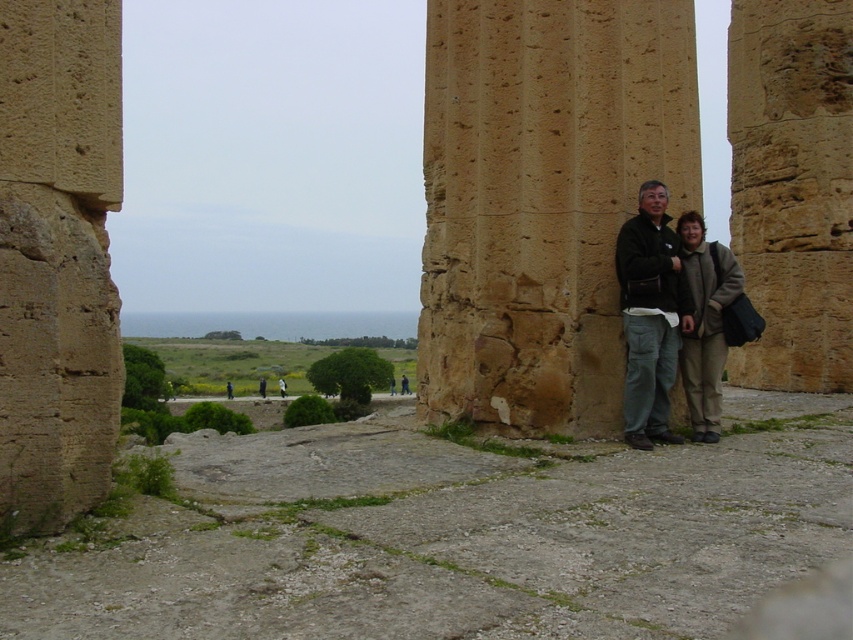
Question: Is brown rough stone pillar at right to the left of beige woolen coat at lower right from the viewer's perspective?

Choices:
 (A) no
 (B) yes

Answer: (B)

Question: Can you confirm if brown rough stone pillar at right is bigger than beige stone pillar at center?

Choices:
 (A) yes
 (B) no

Answer: (B)

Question: Which point appears closest to the camera in this image?

Choices:
 (A) (672, 244)
 (B) (578, 420)

Answer: (B)

Question: Which of the following is the farthest from the observer?

Choices:
 (A) matte brown jacket at center
 (B) brown rough stone pillar at right
 (C) beige stone pillar at center
 (D) beige woolen coat at lower right

Answer: (B)

Question: Does beige stone pillar at center have a smaller size compared to beige woolen coat at lower right?

Choices:
 (A) no
 (B) yes

Answer: (A)

Question: Considering the real-world distances, which object is farthest from the beige stone pillar at center?

Choices:
 (A) beige woolen coat at lower right
 (B) matte brown jacket at center
 (C) brown rough stone pillar at right

Answer: (C)